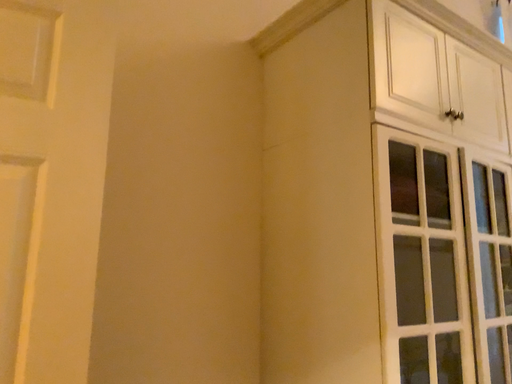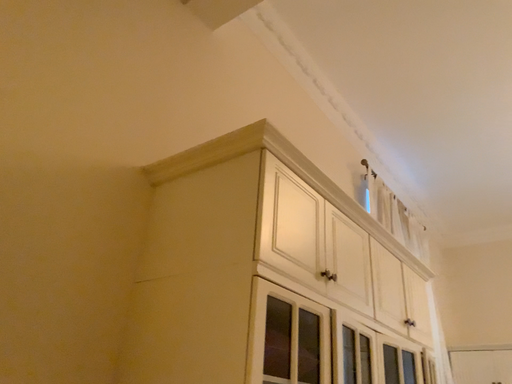
Question: Which way did the camera rotate in the video?

Choices:
 (A) rotated left
 (B) rotated right

Answer: (B)